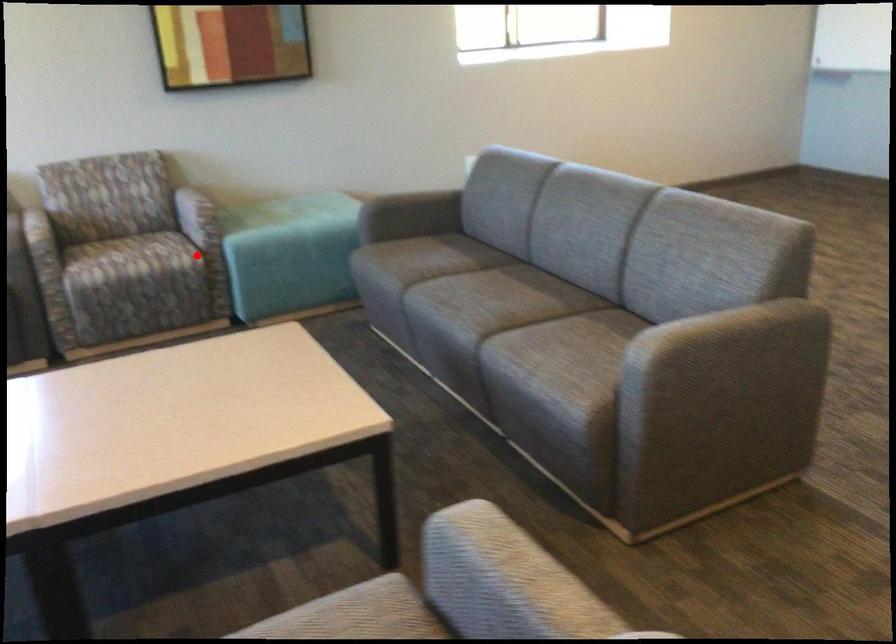
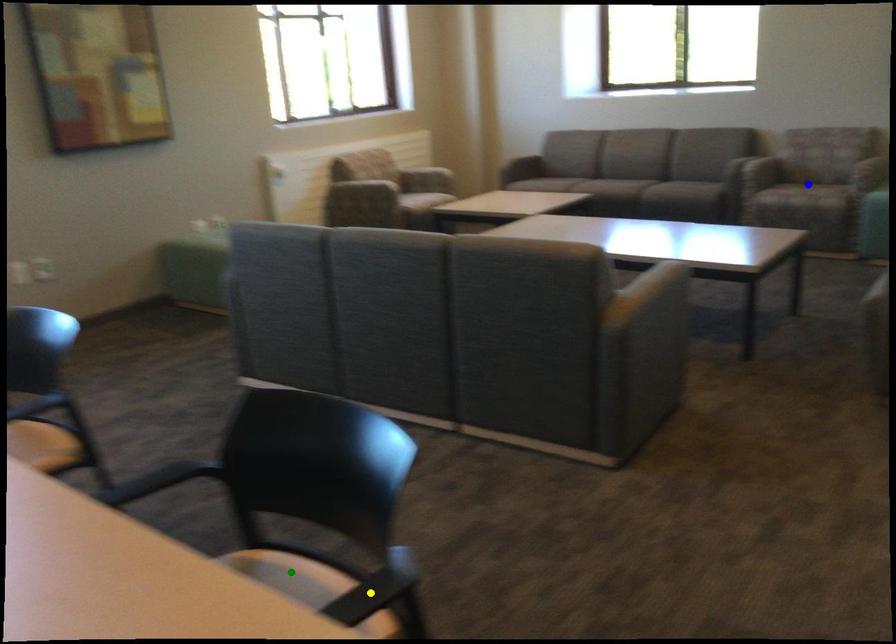
Question: I am providing you with two images of the same scene from different viewpoints. A red point is marked on the first image. You are given multiple points on the second image. Can you choose the point in image 2 that corresponds to the point in image 1?

Choices:
 (A) yellow point
 (B) green point
 (C) blue point

Answer: (C)